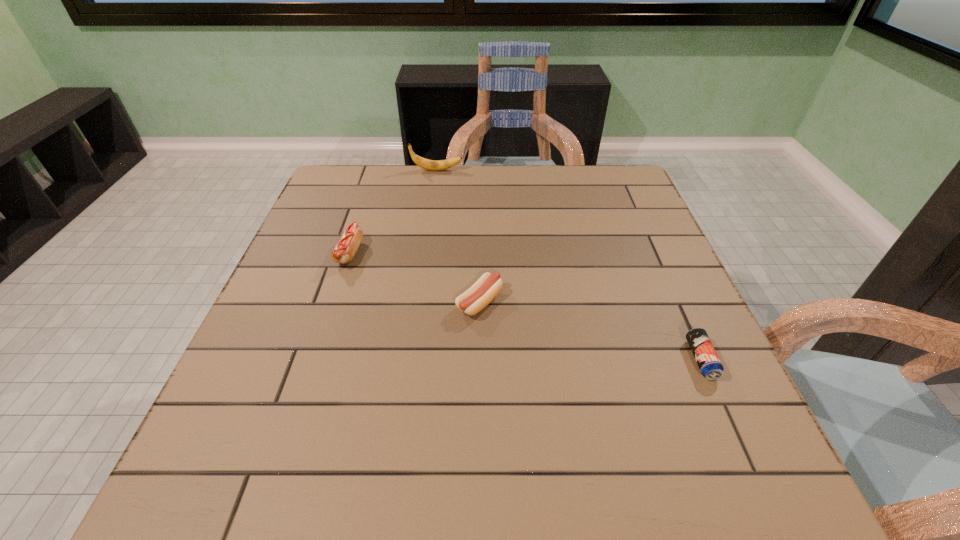
Find the location of `the tallest object`. the tallest object is located at coordinates (427, 164).

Image resolution: width=960 pixels, height=540 pixels. What are the coordinates of `the third object from right to left` in the screenshot? It's located at (427, 164).

You are a GUI agent. You are given a task and a screenshot of the screen. Output one action in this format:
    pyautogui.click(x=<x>, y=<y>)
    Task: Click on the second tallest object
    
    Given the screenshot: What is the action you would take?
    pyautogui.click(x=344, y=251)

You are a GUI agent. You are given a task and a screenshot of the screen. Output one action in this format:
    pyautogui.click(x=<x>, y=<y>)
    Task: Click on the farther sausage
    
    Given the screenshot: What is the action you would take?
    pyautogui.click(x=344, y=251)

Where is `the nearer sausage`? The image size is (960, 540). the nearer sausage is located at coordinates (484, 290).

At what (x,y) coordinates should I click in order to perform the action: click on the second nearest object. Please return your answer as a coordinate pair (x, y). This screenshot has height=540, width=960. Looking at the image, I should click on (484, 290).

Image resolution: width=960 pixels, height=540 pixels. Identify the location of beer can. (704, 353).

Find the location of a particular element. The image size is (960, 540). the nearest object is located at coordinates (704, 353).

I want to click on blank area located 0.220m on the peel of the tallest object from the top, so click(534, 170).

What are the coordinates of `blank space located 0.070m on the front of the taller sausage` in the screenshot? It's located at (336, 293).